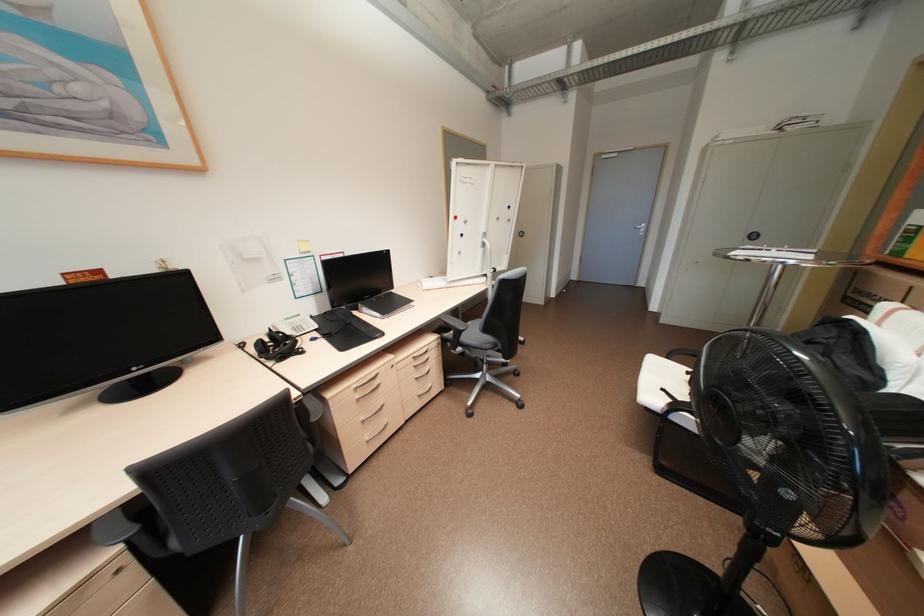
This screenshot has width=924, height=616. I want to click on silver door handle, so click(640, 228).